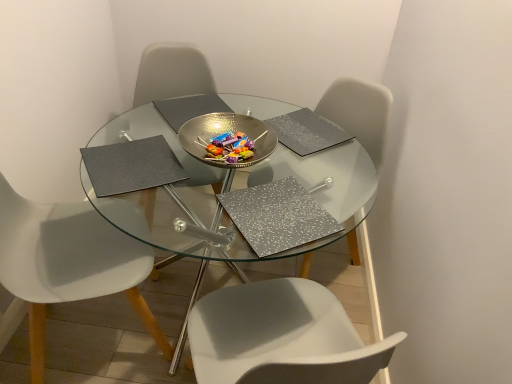
Question: From a real-world perspective, is silver textured pad at upper center, the 1th pad from the right, physically located above or below white plastic chair at left, the first chair positioned from the left?

Choices:
 (A) above
 (B) below

Answer: (A)

Question: Choose the correct answer: Is silver textured pad at upper center, the 1th pad from the right, inside white plastic chair at left, the first chair positioned from the left, or outside it?

Choices:
 (A) outside
 (B) inside

Answer: (A)

Question: Which object is positioned closest to the transparent glass table at center?

Choices:
 (A) white plastic chair at left, the third chair when ordered from right to left
 (B) gray matte placemat at upper left, the first pad when ordered from left to right
 (C) white plastic chair at center, acting as the 1th chair starting from the right
 (D) silver textured pad at upper center, the 1th pad from the right
 (E) white plastic chair at center, which is the second chair from right to left

Answer: (B)

Question: Considering the real-world distances, which object is farthest from the silver textured pad at center, the 2th pad when ordered from right to left?

Choices:
 (A) white plastic chair at left, the third chair when ordered from right to left
 (B) gray matte placemat at upper left, the first pad when ordered from left to right
 (C) silver textured pad at upper center, the 1th pad from the right
 (D) white plastic chair at center, arranged as the 3th chair when viewed from the left
 (E) metallic bowl at center

Answer: (D)